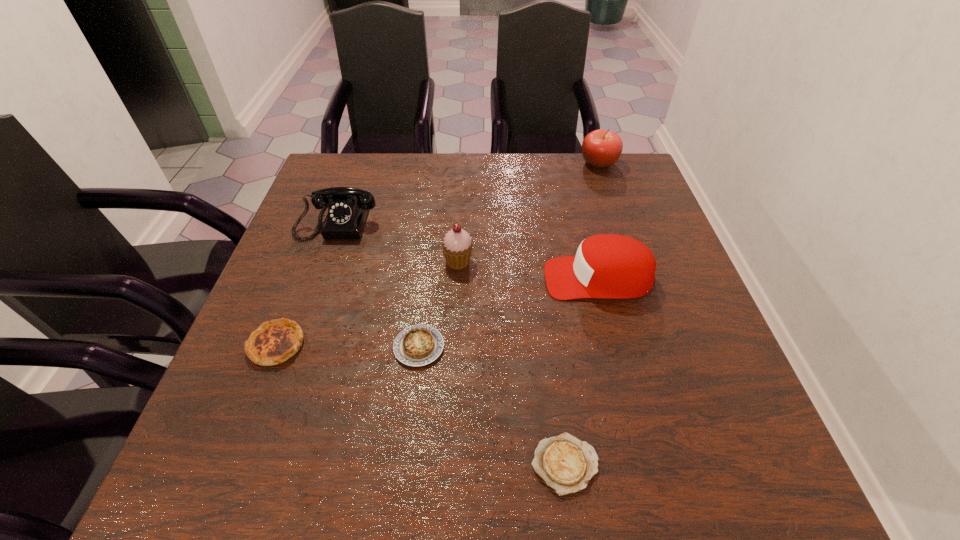
Where is `apple`? The image size is (960, 540). apple is located at coordinates (600, 148).

The width and height of the screenshot is (960, 540). I want to click on cupcake, so click(457, 246).

Find the location of a particular element. the second farthest object is located at coordinates (347, 207).

The width and height of the screenshot is (960, 540). Find the location of `baseball cap`. baseball cap is located at coordinates (610, 266).

The height and width of the screenshot is (540, 960). In order to click on the tallest quiche in this screenshot , I will do `click(274, 342)`.

Identify the location of the leftmost quiche. (274, 342).

This screenshot has width=960, height=540. Find the location of `the second quiche from right to left`. the second quiche from right to left is located at coordinates (418, 345).

This screenshot has width=960, height=540. Identify the location of the second shortest object. coord(418,345).

At what (x,y) coordinates should I click in order to perform the action: click on the nearest object. Please return your answer as a coordinate pair (x, y). This screenshot has height=540, width=960. Looking at the image, I should click on (566, 464).

Where is `the nearest quiche`? the nearest quiche is located at coordinates (566, 464).